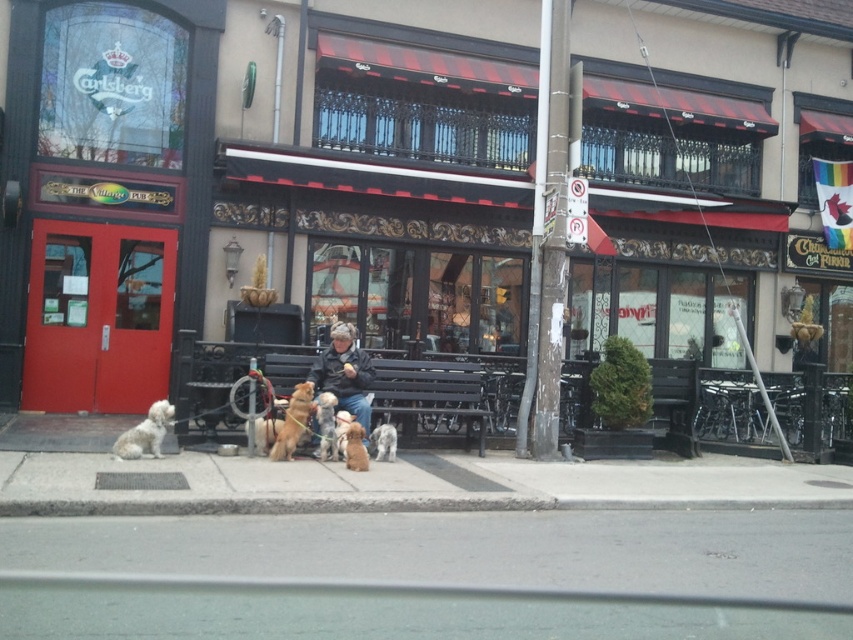
Question: Can you confirm if golden brown fur at center is smaller than soft brown fur at center?

Choices:
 (A) yes
 (B) no

Answer: (B)

Question: Which of the following is the closest to the observer?

Choices:
 (A) soft beige fur at center
 (B) golden brown fur at center

Answer: (B)

Question: Based on their relative distances, which object is nearer to the matte black bench at center?

Choices:
 (A) soft brown fur at center
 (B) gray asphalt at lower center

Answer: (A)

Question: Does matte black bench at center appear on the left side of soft brown fur at center?

Choices:
 (A) no
 (B) yes

Answer: (A)

Question: Observing the image, what is the correct spatial positioning of dark brown leather jacket at center in reference to soft brown fur at center?

Choices:
 (A) below
 (B) above

Answer: (B)

Question: Which of the following is the closest to the observer?

Choices:
 (A) pos(316,420)
 (B) pos(335,340)
 (C) pos(357,500)
 (D) pos(646,545)

Answer: (D)